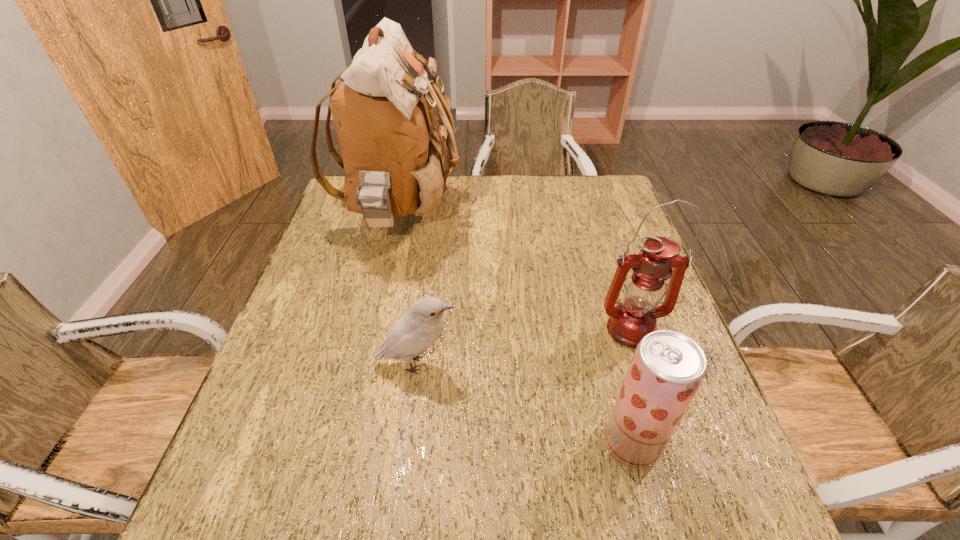
This screenshot has width=960, height=540. I want to click on the tallest object, so click(x=394, y=148).

Find the location of a particular element. This screenshot has height=540, width=960. the farthest object is located at coordinates (394, 148).

Identify the location of the third shortest object. The width and height of the screenshot is (960, 540). (635, 317).

This screenshot has width=960, height=540. I want to click on the third nearest object, so click(x=635, y=317).

This screenshot has height=540, width=960. In order to click on the nearest object in this screenshot , I will do `click(667, 368)`.

Image resolution: width=960 pixels, height=540 pixels. I want to click on the third tallest object, so click(667, 368).

Where is `bird`? The height and width of the screenshot is (540, 960). bird is located at coordinates (410, 336).

What are the coordinates of `the shortest object` in the screenshot? It's located at (410, 336).

Locate an element on the screen. vacant space positioned 0.120m on the front-facing side of the backpack is located at coordinates (501, 216).

The height and width of the screenshot is (540, 960). Find the location of `vacant space situated 0.300m on the front of the oil lamp`. vacant space situated 0.300m on the front of the oil lamp is located at coordinates (680, 486).